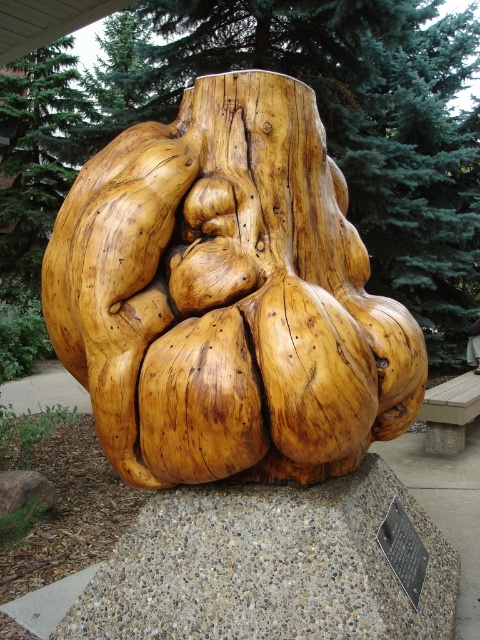
Question: Is natural wood sculpture at center to the right of wooden bench at center from the viewer's perspective?

Choices:
 (A) yes
 (B) no

Answer: (B)

Question: Does natural wood sculpture at center appear under wooden bench at center?

Choices:
 (A) yes
 (B) no

Answer: (B)

Question: Does natural wood sculpture at center come behind wooden bench at center?

Choices:
 (A) yes
 (B) no

Answer: (B)